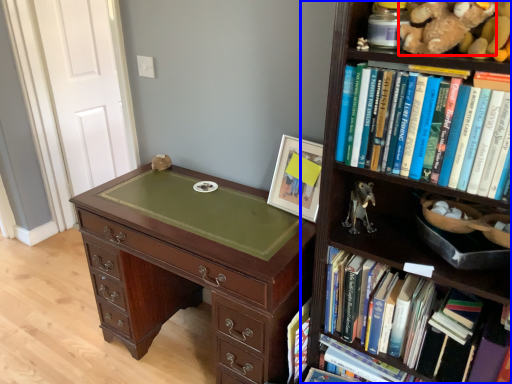
Question: Which object is further to the camera taking this photo, teddy (highlighted by a red box) or bookcase (highlighted by a blue box)?

Choices:
 (A) teddy
 (B) bookcase

Answer: (A)